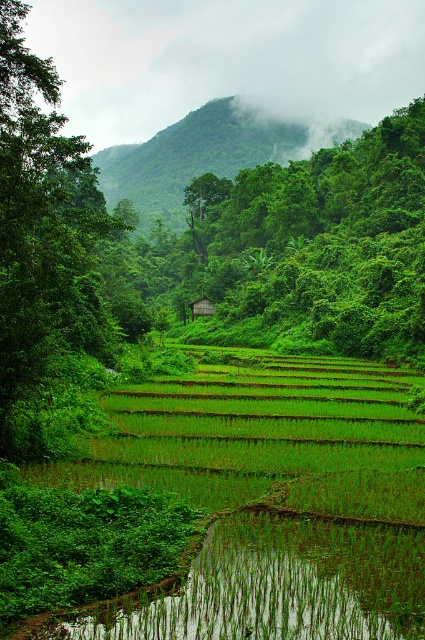
Who is positioned more to the right, green grassy field at center or green leafy tree at left?

green grassy field at center is more to the right.

Between point (212, 636) and point (5, 51), which one is positioned behind?

Point (5, 51)

Image resolution: width=425 pixels, height=640 pixels. What are the coordinates of `green grassy field at center` in the screenshot? It's located at (272, 499).

The height and width of the screenshot is (640, 425). I want to click on green grassy field at center, so click(x=272, y=499).

Can you confirm if green leafy tree at left is positioned above wooden hut at center?

Correct, green leafy tree at left is located above wooden hut at center.

Can you confirm if green leafy tree at left is bigger than wooden hut at center?

Correct, green leafy tree at left is larger in size than wooden hut at center.

Who is more forward, (54,328) or (201,298)?

Point (54,328) is more forward.

In order to click on green leafy tree at left in this screenshot , I will do `click(47, 262)`.

Looking at this image, can you confirm if green grassy field at center is shorter than wooden hut at center?

Yes.

Can you confirm if green grassy field at center is positioned to the right of wooden hut at center?

Yes, green grassy field at center is to the right of wooden hut at center.

Measure the distance between green grassy field at center and camera.

10.20 meters

The height and width of the screenshot is (640, 425). Identify the location of green grassy field at center. (272, 499).